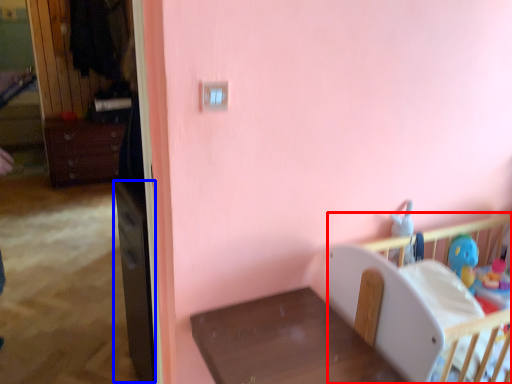
Question: Which of the following is the closest to the observer, infant bed (highlighted by a red box) or file cabinet (highlighted by a blue box)?

Choices:
 (A) infant bed
 (B) file cabinet

Answer: (A)